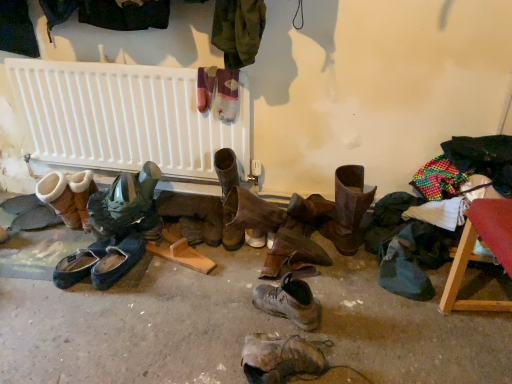
Question: From a real-world perspective, is white plastic radiator at upper center physically located above or below dark blue leather shoes at center, which appears as the 4th footwear when viewed from the left?

Choices:
 (A) above
 (B) below

Answer: (A)

Question: Is white plastic radiator at upper center bigger or smaller than dark blue leather shoes at center, which appears as the 4th footwear when viewed from the left?

Choices:
 (A) small
 (B) big

Answer: (B)

Question: Estimate the real-world distances between objects in this image. Which object is farther from the leather boots at center, the 5th footwear when ordered from left to right?

Choices:
 (A) leather boot at lower center, acting as the 3th footwear starting from the right
 (B) green rubber boots at left, acting as the seventh footwear starting from the right
 (C) leather boot at center, which is the 2th footwear in right-to-left order
 (D) brown leather boot at center, which appears as the ninth footwear when viewed from the left
 (E) black suede slippers at lower left, positioned as the 2th footwear in left-to-right order

Answer: (A)

Question: Which of these objects is positioned closest to the leather boots at center, the 5th footwear when ordered from right to left?

Choices:
 (A) white plastic radiator at upper center
 (B) black suede slippers at lower left, placed as the 8th footwear when sorted from right to left
 (C) suede/leather boot at left, marked as the ninth footwear in a right-to-left arrangement
 (D) brown leather boot at center, which appears as the ninth footwear when viewed from the left
 (E) dark blue leather shoes at center, which is counted as the sixth footwear, starting from the right

Answer: (E)